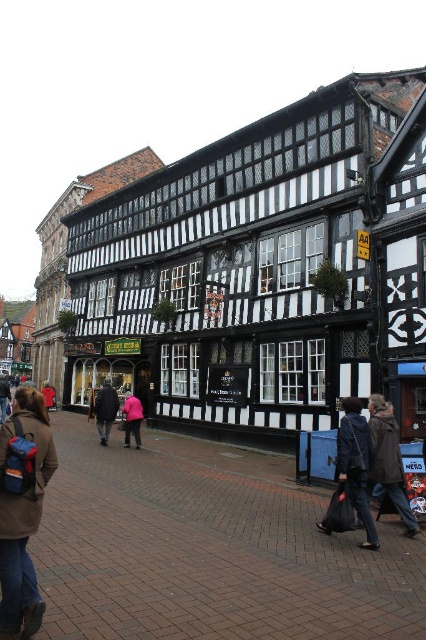
Who is lower down, pink fabric person at center or red jacket at center?

pink fabric person at center

Which is above, pink fabric person at center or red jacket at center?

red jacket at center is higher up.

Does point (129, 401) lie behind point (54, 403)?

No, it is in front of (54, 403).

The height and width of the screenshot is (640, 426). I want to click on pink fabric person at center, so click(x=132, y=419).

Is point (192, 522) positioned behind point (54, 394)?

No, (192, 522) is closer to viewer.

Does matte black brick at center lie in front of red jacket at center?

Yes, matte black brick at center is in front of red jacket at center.

Between point (377, 563) and point (43, 396), which one is positioned in front?

Point (377, 563) is more forward.

Where is `matte black brick at center`? Image resolution: width=426 pixels, height=640 pixels. matte black brick at center is located at coordinates (204, 548).

Is point (344, 433) closer to camera compared to point (104, 396)?

Yes, point (344, 433) is closer to viewer.

Does dark blue fabric jacket at lower right come in front of dark brown leather jacket at center?

Yes, it is in front of dark brown leather jacket at center.

The height and width of the screenshot is (640, 426). What are the coordinates of `dark blue fabric jacket at lower right` in the screenshot? It's located at (354, 460).

Find the location of a particular element. dark blue fabric jacket at lower right is located at coordinates (354, 460).